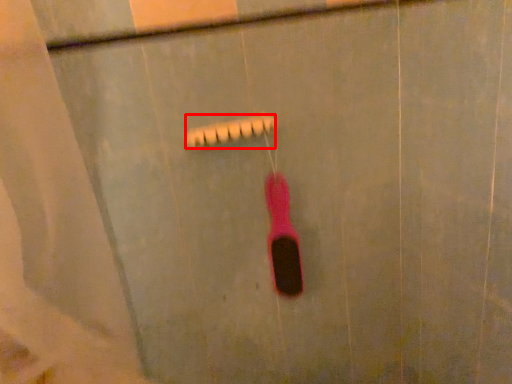
Question: Where is shower (annotated by the red box) located in relation to toothbrush in the image?

Choices:
 (A) right
 (B) left

Answer: (B)